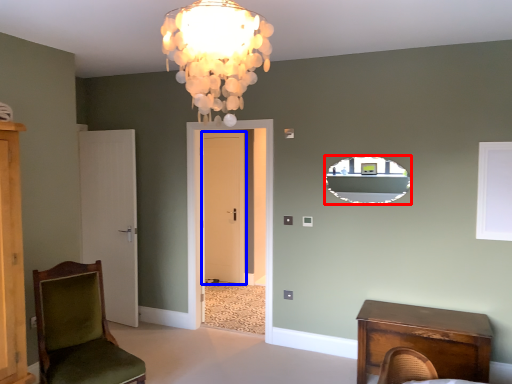
Question: Which point is closer to the camera, mirror (highlighted by a red box) or door (highlighted by a blue box)?

Choices:
 (A) mirror
 (B) door

Answer: (A)